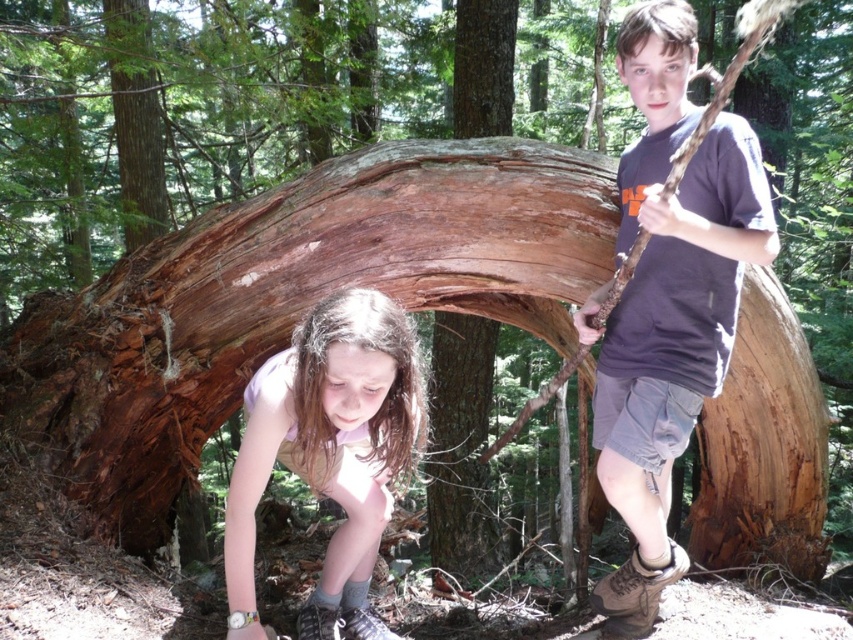
You are a child in the forest scene. You want to use the matte brown stick at right to reach an apple that is higher up on a tree. Can the stick reach the apple if the apple is at the same height as the light pink fabric shirt at lower center?

The matte brown stick at right is taller than the light pink fabric shirt at lower center. Since the apple is at the same height as the light pink fabric shirt at lower center, the stick can reach the apple.

You are the girl in the image and you want to throw the matte brown stick at right to the boy standing to your right. Can you reach him by throwing the stick straight forward from your current position?

Yes, because the boy is standing to your right, and the matte brown stick at right is positioned at point (x=668, y=300) in the image, which is in the direction of the boy. Throwing the stick straight forward from your position would send it towards the boy.

You are a photographer trying to capture both the matte brown stick at right and the light pink fabric shirt at lower center in the same frame. Which object should you adjust your camera focus to ensure both are in focus?

Both the matte brown stick at right and the light pink fabric shirt at lower center are in the scene. Since the light pink fabric shirt at lower center is behind the matte brown stick at right, adjusting the focus to the matte brown stick at right will ensure both are in focus as the shirt is further back.